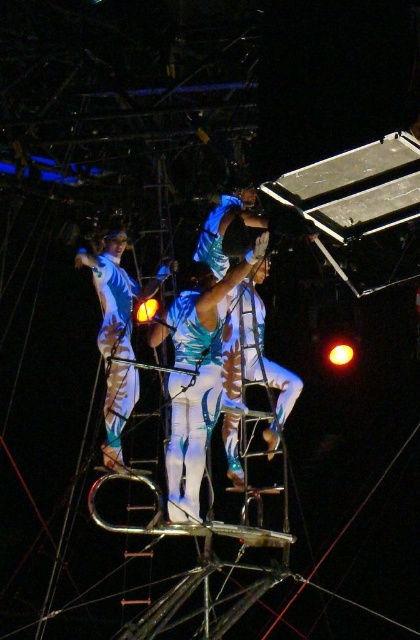
Question: Does shiny teal fabric at center have a smaller size compared to white glossy leotard at upper center?

Choices:
 (A) no
 (B) yes

Answer: (B)

Question: Estimate the real-world distances between objects in this image. Which object is farther from the shiny metallic costume at center?

Choices:
 (A) white glossy leotard at upper center
 (B) shiny teal fabric at center

Answer: (A)

Question: Which point appears closest to the camera in this image?

Choices:
 (A) (204, 291)
 (B) (118, 276)
 (C) (230, 243)

Answer: (C)

Question: Does shiny teal fabric at center have a greater width compared to white glossy leotard at upper center?

Choices:
 (A) no
 (B) yes

Answer: (B)

Question: Is shiny teal fabric at center below white glossy leotard at upper center?

Choices:
 (A) no
 (B) yes

Answer: (B)

Question: Which of the following is the farthest from the observer?

Choices:
 (A) shiny teal fabric at center
 (B) shiny metallic costume at center

Answer: (A)